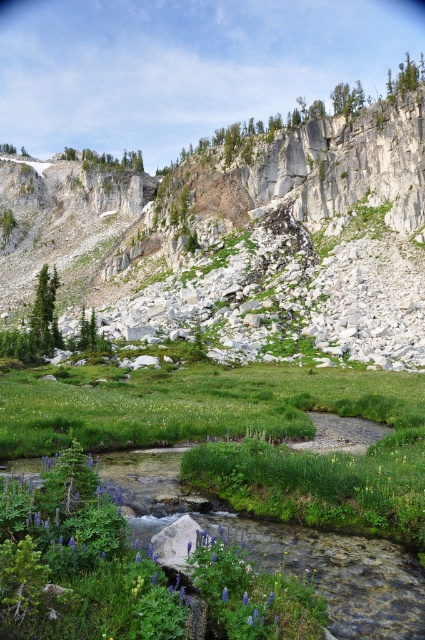
You are standing at the edge of the stream in the meadow and see two points marked in the image. One is at point (223, 211) and the other at point (243, 596). Which point is closer to you?

Point (223, 211) is further to the camera than point (243, 596), so the point closer to you is point (243, 596).

You are standing at the point labeled point (251, 236) in the image. What is the nearest object to you in the scene?

The nearest object to you at point (251, 236) is the white rocky mountain at upper center, as the point corresponds to that location.